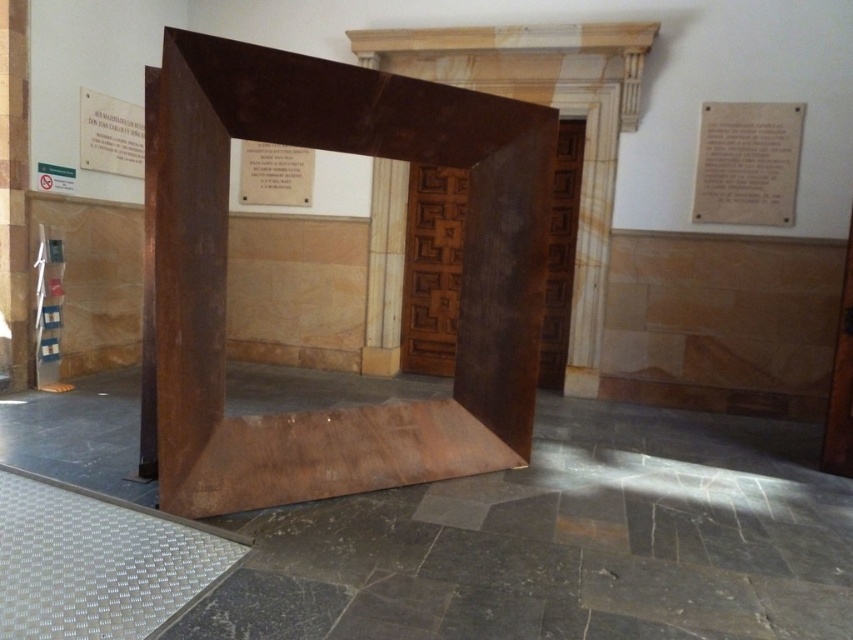
How distant is rusty metal cube at center from matte white plaque at upper right?

A distance of 9.41 feet exists between rusty metal cube at center and matte white plaque at upper right.

Is rusty metal cube at center to the left of matte white plaque at upper right from the viewer's perspective?

Indeed, rusty metal cube at center is positioned on the left side of matte white plaque at upper right.

The width and height of the screenshot is (853, 640). I want to click on rusty metal cube at center, so click(x=225, y=262).